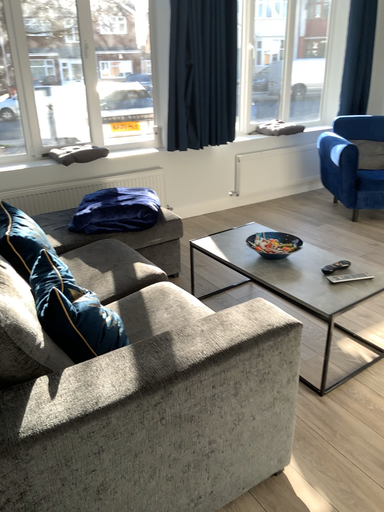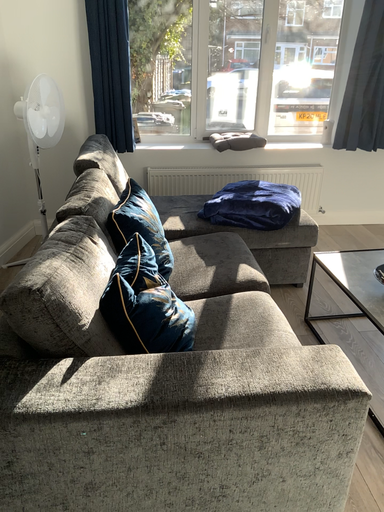
Question: Which way did the camera rotate in the video?

Choices:
 (A) rotated right
 (B) rotated left

Answer: (B)